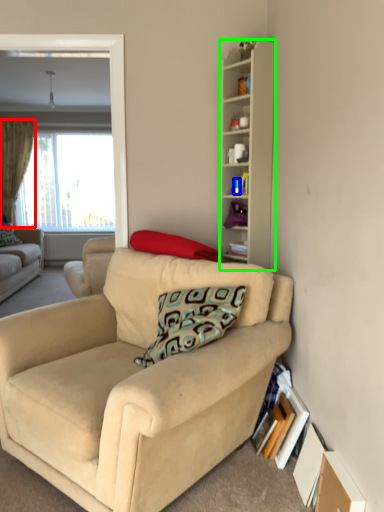
Question: Estimate the real-world distances between objects in this image. Which object is closer to curtain (highlighted by a red box), teal (highlighted by a blue box) or cabinetry (highlighted by a green box)?

Choices:
 (A) teal
 (B) cabinetry

Answer: (B)